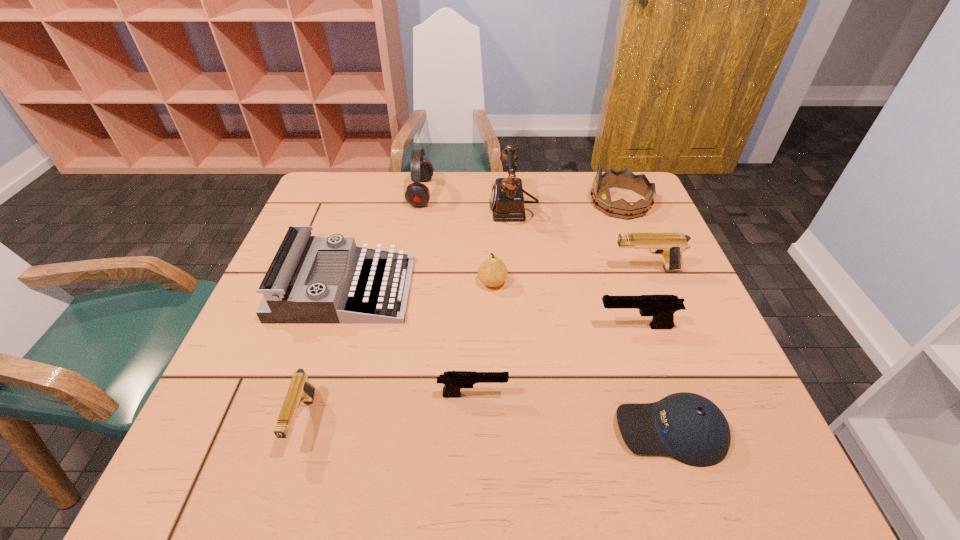
The width and height of the screenshot is (960, 540). Identify the location of gray telephone. (507, 200).

You are a GUI agent. You are given a task and a screenshot of the screen. Output one action in this format:
    pyautogui.click(x=<x>, y=<y>)
    Task: Click on the earphone
    Image resolution: width=960 pixels, height=540 pixels.
    Given the screenshot: What is the action you would take?
    pyautogui.click(x=417, y=194)

You are a GUI agent. You are given a task and a screenshot of the screen. Output one action in this format:
    pyautogui.click(x=<x>, y=<y>)
    Task: Click on the red tiara
    
    Given the screenshot: What is the action you would take?
    pyautogui.click(x=625, y=179)

Where is `the farther tan pistol`? the farther tan pistol is located at coordinates point(671,246).

You are a GUI agent. You are given a task and a screenshot of the screen. Output one action in this format:
    pyautogui.click(x=<x>, y=<y>)
    Task: Click on the farthest pistol
    The width and height of the screenshot is (960, 540).
    Given the screenshot: What is the action you would take?
    [671, 246]

Find the location of a particular element. This screenshot has width=960, height=540. black typewriter is located at coordinates (291, 295).

Image resolution: width=960 pixels, height=540 pixels. I want to click on the farther black pistol, so click(662, 307).

At what (x,y) coordinates should I click in order to perform the action: click on the right black pistol. Please return your answer as a coordinate pair (x, y). This screenshot has height=540, width=960. Looking at the image, I should click on (662, 307).

Find the location of a particular element. The width and height of the screenshot is (960, 540). pear is located at coordinates (492, 272).

Identify the location of the smaller tan pistol. (300, 390).